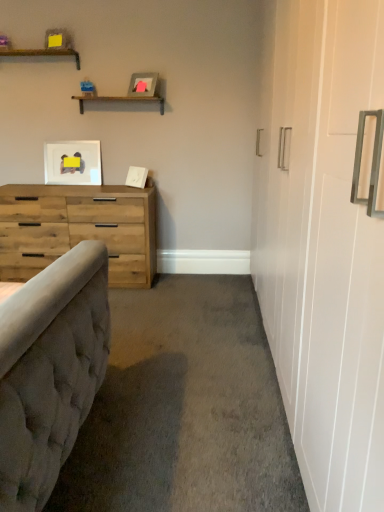
Question: From a real-world perspective, is wooden shelf at upper center, which is the 2th shelf in left-to-right order, over natural wood dresser at left?

Choices:
 (A) no
 (B) yes

Answer: (B)

Question: Can you confirm if wooden shelf at upper center, which is counted as the 1th shelf, starting from the bottom, is positioned to the left of natural wood dresser at left?

Choices:
 (A) yes
 (B) no

Answer: (B)

Question: Considering the relative sizes of wooden shelf at upper center, which is the 2th shelf in left-to-right order, and natural wood dresser at left in the image provided, is wooden shelf at upper center, which is the 2th shelf in left-to-right order, shorter than natural wood dresser at left?

Choices:
 (A) yes
 (B) no

Answer: (A)

Question: Is wooden shelf at upper center, which is the 2th shelf in left-to-right order, turned away from natural wood dresser at left?

Choices:
 (A) no
 (B) yes

Answer: (A)

Question: From the image's perspective, is matte gray picture frame at upper center, the 1th picture frame in the right-to-left sequence, positioned above or below wooden shelf at upper center, which is counted as the 1th shelf, starting from the bottom?

Choices:
 (A) below
 (B) above

Answer: (B)

Question: Considering the relative positions of matte gray picture frame at upper center, the second picture frame when ordered from left to right, and wooden shelf at upper center, which is the 2th shelf in left-to-right order, in the image provided, is matte gray picture frame at upper center, the second picture frame when ordered from left to right, to the left or to the right of wooden shelf at upper center, which is the 2th shelf in left-to-right order,?

Choices:
 (A) right
 (B) left

Answer: (A)

Question: Considering the positions of matte gray picture frame at upper center, the second picture frame when ordered from left to right, and wooden shelf at upper center, which is counted as the 1th shelf, starting from the bottom, in the image, is matte gray picture frame at upper center, the second picture frame when ordered from left to right, wider or thinner than wooden shelf at upper center, which is counted as the 1th shelf, starting from the bottom,?

Choices:
 (A) wide
 (B) thin

Answer: (B)

Question: Is matte gray picture frame at upper center, the second picture frame when ordered from left to right, taller or shorter than wooden shelf at upper center, which is counted as the 1th shelf, starting from the bottom?

Choices:
 (A) short
 (B) tall

Answer: (B)

Question: Would you say natural wood dresser at left is inside or outside wooden shelf at upper center, which is counted as the 1th shelf, starting from the bottom?

Choices:
 (A) outside
 (B) inside

Answer: (A)

Question: Is natural wood dresser at left wider or thinner than wooden shelf at upper center, which is counted as the 1th shelf, starting from the bottom?

Choices:
 (A) wide
 (B) thin

Answer: (A)

Question: From a real-world perspective, is natural wood dresser at left physically located above or below wooden shelf at upper center, which is the first shelf from right to left?

Choices:
 (A) above
 (B) below

Answer: (B)

Question: Looking at the image, does natural wood dresser at left seem bigger or smaller compared to wooden shelf at upper center, which is counted as the 1th shelf, starting from the bottom?

Choices:
 (A) small
 (B) big

Answer: (B)

Question: Is point 61,145 positioned closer to the camera than point 26,50?

Choices:
 (A) closer
 (B) farther

Answer: (B)

Question: In terms of height, does matte white picture frame at upper left, placed as the first picture frame when sorted from left to right, look taller or shorter compared to wooden shelf at upper left, which is the first shelf in top-to-bottom order?

Choices:
 (A) tall
 (B) short

Answer: (A)